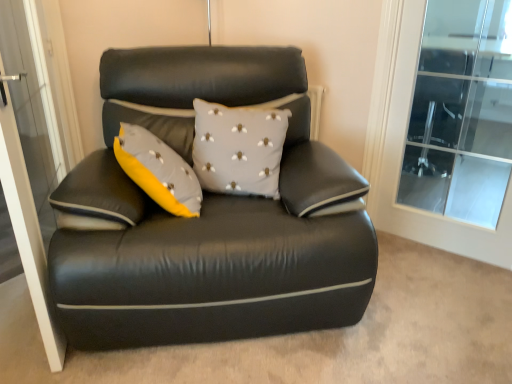
Question: Does transparent glass screen door at left lie in front of black leather couch at center?

Choices:
 (A) yes
 (B) no

Answer: (A)

Question: Can you confirm if transparent glass screen door at left is bigger than black leather couch at center?

Choices:
 (A) yes
 (B) no

Answer: (B)

Question: Does transparent glass screen door at left contain black leather couch at center?

Choices:
 (A) no
 (B) yes

Answer: (A)

Question: Is transparent glass screen door at left not close to black leather couch at center?

Choices:
 (A) no
 (B) yes

Answer: (A)

Question: From the image's perspective, is transparent glass screen door at left over black leather couch at center?

Choices:
 (A) yes
 (B) no

Answer: (A)

Question: From a real-world perspective, is transparent glass screen door at left above or below gray fabric cushion at center?

Choices:
 (A) below
 (B) above

Answer: (A)

Question: Is point (16, 200) positioned closer to the camera than point (207, 157)?

Choices:
 (A) closer
 (B) farther

Answer: (A)

Question: Is transparent glass screen door at left bigger or smaller than gray fabric cushion at center?

Choices:
 (A) small
 (B) big

Answer: (B)

Question: Is transparent glass screen door at left to the left or to the right of gray fabric cushion at center in the image?

Choices:
 (A) right
 (B) left

Answer: (B)

Question: In terms of size, does black leather couch at center appear bigger or smaller than transparent glass screen door at left?

Choices:
 (A) big
 (B) small

Answer: (A)

Question: Is point (99, 187) positioned closer to the camera than point (62, 122)?

Choices:
 (A) farther
 (B) closer

Answer: (B)

Question: From a real-world perspective, is black leather couch at center above or below transparent glass screen door at left?

Choices:
 (A) above
 (B) below

Answer: (B)

Question: Do you think black leather couch at center is within transparent glass screen door at left, or outside of it?

Choices:
 (A) outside
 (B) inside

Answer: (A)

Question: In the image, is transparent glass screen door at left positioned in front of or behind black leather couch at center?

Choices:
 (A) behind
 (B) front

Answer: (B)

Question: Is transparent glass screen door at left wider or thinner than black leather couch at center?

Choices:
 (A) thin
 (B) wide

Answer: (A)